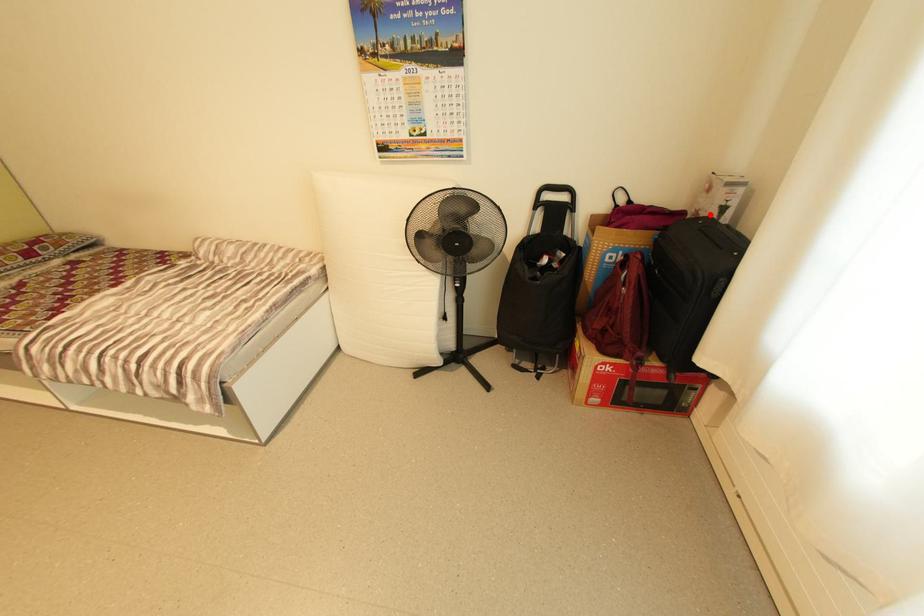
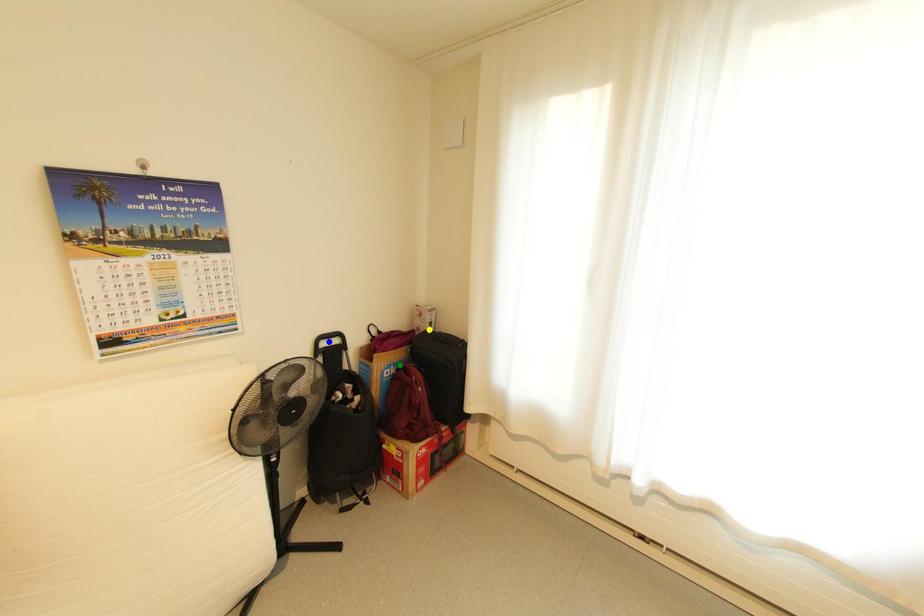
Question: I am providing you with two images of the same scene from different viewpoints. A red point is marked on the first image. You are given multiple points on the second image. Which point in image 2 is actually the same real-world point as the red point in image 1?

Choices:
 (A) yellow point
 (B) blue point
 (C) green point

Answer: (A)